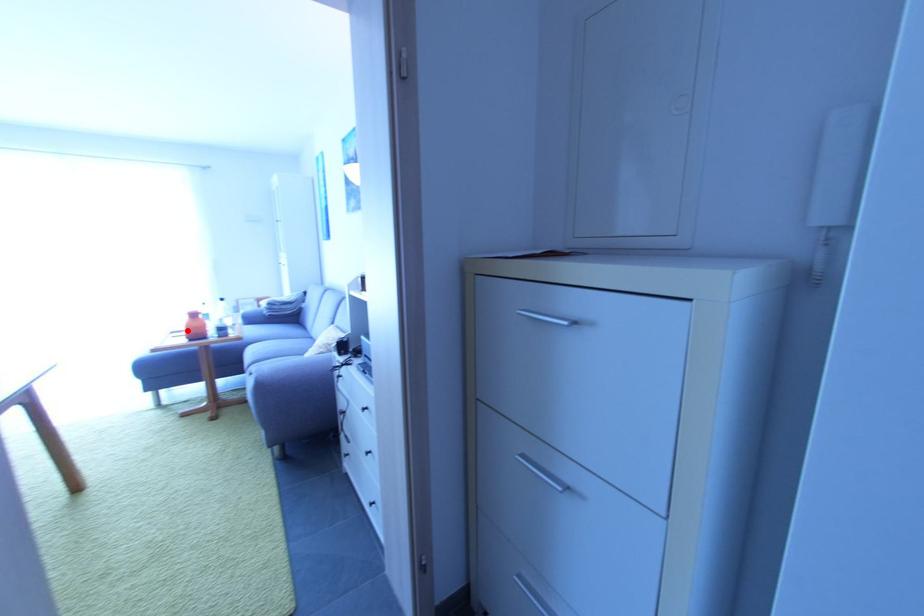
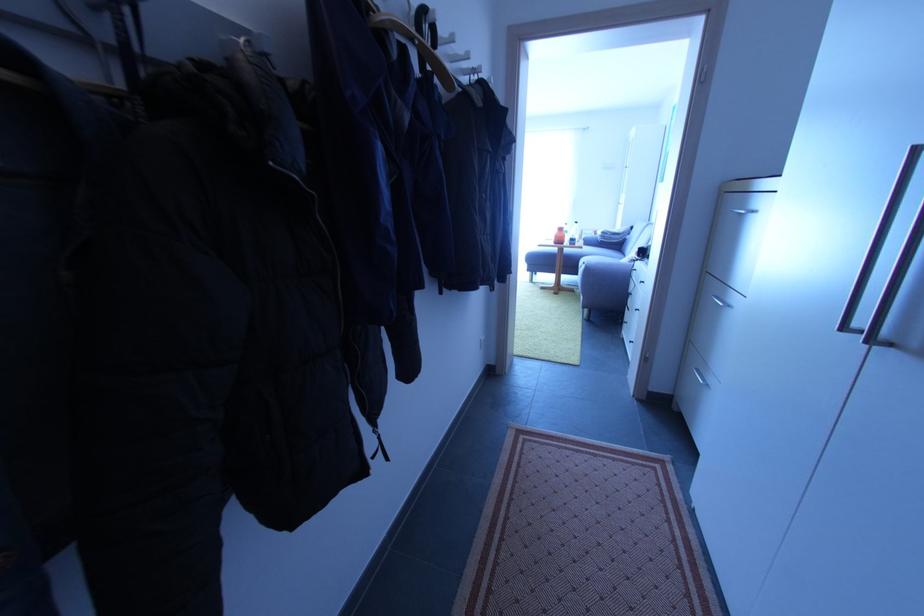
Locate, in the second image, the point that corresponds to the highlighted location in the first image.

(557, 238)